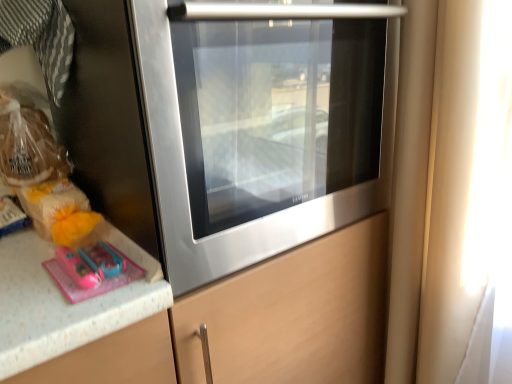
Where is `stainless steel oven at center`? The height and width of the screenshot is (384, 512). stainless steel oven at center is located at coordinates (259, 125).

Does translucent plastic bread at left, marked as the first food in a top-to-bottom arrangement, have a greater width compared to translucent plastic bag at left, which ranks as the 1th food in bottom-to-top order?

No.

From a real-world perspective, is translucent plastic bread at left, the second food in the bottom-to-top sequence, above or below translucent plastic bag at left, which ranks as the 2th food in top-to-bottom order?

From a real-world perspective, translucent plastic bread at left, the second food in the bottom-to-top sequence, is physically above translucent plastic bag at left, which ranks as the 2th food in top-to-bottom order.

The width and height of the screenshot is (512, 384). I want to click on food below the translucent plastic bread at left, the second food in the bottom-to-top sequence (from a real-world perspective), so click(x=60, y=212).

Is translucent plastic bread at left, marked as the first food in a top-to-bottom arrangement, next to translucent plastic bag at left, which ranks as the 1th food in bottom-to-top order, and touching it?

No.

From a real-world perspective, is stainless steel oven at center physically located above or below transparent glass window at right?

Clearly, from a real-world perspective, stainless steel oven at center is above transparent glass window at right.

Can you confirm if stainless steel oven at center is smaller than transparent glass window at right?

Incorrect, stainless steel oven at center is not smaller in size than transparent glass window at right.

Which object is closer to the camera, stainless steel oven at center or transparent glass window at right?

stainless steel oven at center is more forward.

In order to click on food that is above the translucent plastic bag at left, which ranks as the 2th food in top-to-bottom order (from the image's perspective) in this screenshot , I will do `click(28, 146)`.

Is translucent plastic bag at left, which ranks as the 2th food in top-to-bottom order, outside of translucent plastic bread at left, marked as the first food in a top-to-bottom arrangement?

translucent plastic bag at left, which ranks as the 2th food in top-to-bottom order, is positioned outside translucent plastic bread at left, marked as the first food in a top-to-bottom arrangement.

In the image, is translucent plastic bag at left, which ranks as the 2th food in top-to-bottom order, on the left side or the right side of translucent plastic bread at left, marked as the first food in a top-to-bottom arrangement?

translucent plastic bag at left, which ranks as the 2th food in top-to-bottom order, is positioned on translucent plastic bread at left, marked as the first food in a top-to-bottom arrangement,'s right side.

Does translucent plastic bag at left, which ranks as the 1th food in bottom-to-top order, have a lesser width compared to translucent plastic bread at left, the second food in the bottom-to-top sequence?

No.

Which object is further away from the camera taking this photo, transparent glass window at right or translucent plastic bag at left, which ranks as the 2th food in top-to-bottom order?

Positioned behind is translucent plastic bag at left, which ranks as the 2th food in top-to-bottom order.

What's the angular difference between transparent glass window at right and translucent plastic bag at left, which ranks as the 2th food in top-to-bottom order,'s facing directions?

transparent glass window at right and translucent plastic bag at left, which ranks as the 2th food in top-to-bottom order, are facing 90 degrees away from each other.

Considering the sizes of objects transparent glass window at right and translucent plastic bag at left, which ranks as the 1th food in bottom-to-top order, in the image provided, who is thinner, transparent glass window at right or translucent plastic bag at left, which ranks as the 1th food in bottom-to-top order,?

Thinner between the two is transparent glass window at right.

Is transparent glass window at right positioned with its back to translucent plastic bag at left, which ranks as the 1th food in bottom-to-top order?

No.

Is translucent plastic bread at left, marked as the first food in a top-to-bottom arrangement, aimed at transparent glass window at right?

No, translucent plastic bread at left, marked as the first food in a top-to-bottom arrangement, is not turned towards transparent glass window at right.

From the image's perspective, is translucent plastic bread at left, marked as the first food in a top-to-bottom arrangement, above or below transparent glass window at right?

translucent plastic bread at left, marked as the first food in a top-to-bottom arrangement, is situated higher than transparent glass window at right in the image.

Which object is wider, translucent plastic bread at left, marked as the first food in a top-to-bottom arrangement, or transparent glass window at right?

transparent glass window at right.

Can you confirm if translucent plastic bread at left, the second food in the bottom-to-top sequence, is bigger than transparent glass window at right?

No, translucent plastic bread at left, the second food in the bottom-to-top sequence, is not bigger than transparent glass window at right.

Is translucent plastic bag at left, which ranks as the 2th food in top-to-bottom order, taller than transparent glass window at right?

Incorrect, the height of translucent plastic bag at left, which ranks as the 2th food in top-to-bottom order, is not larger of that of transparent glass window at right.

From a real-world perspective, is translucent plastic bag at left, which ranks as the 1th food in bottom-to-top order, on top of transparent glass window at right?

Yes, from a real-world perspective, translucent plastic bag at left, which ranks as the 1th food in bottom-to-top order, is on top of transparent glass window at right.

Is translucent plastic bag at left, which ranks as the 1th food in bottom-to-top order, positioned far away from transparent glass window at right?

No, there isn't a large distance between translucent plastic bag at left, which ranks as the 1th food in bottom-to-top order, and transparent glass window at right.

Looking at their sizes, would you say translucent plastic bag at left, which ranks as the 1th food in bottom-to-top order, is wider or thinner than transparent glass window at right?

translucent plastic bag at left, which ranks as the 1th food in bottom-to-top order, is wider than transparent glass window at right.

Is stainless steel oven at center taller than translucent plastic bag at left, which ranks as the 1th food in bottom-to-top order?

Indeed, stainless steel oven at center has a greater height compared to translucent plastic bag at left, which ranks as the 1th food in bottom-to-top order.

Can you confirm if stainless steel oven at center is bigger than translucent plastic bag at left, which ranks as the 2th food in top-to-bottom order?

Yes, stainless steel oven at center is bigger than translucent plastic bag at left, which ranks as the 2th food in top-to-bottom order.

Considering the positions of objects stainless steel oven at center and translucent plastic bag at left, which ranks as the 1th food in bottom-to-top order, in the image provided, who is more to the right, stainless steel oven at center or translucent plastic bag at left, which ranks as the 1th food in bottom-to-top order,?

stainless steel oven at center is more to the right.

From the image's perspective, between stainless steel oven at center and translucent plastic bag at left, which ranks as the 2th food in top-to-bottom order, who is located below?

translucent plastic bag at left, which ranks as the 2th food in top-to-bottom order.

Locate an element on the screen. This screenshot has height=384, width=512. food that is behind the translucent plastic bag at left, which ranks as the 2th food in top-to-bottom order is located at coordinates (28, 146).

Image resolution: width=512 pixels, height=384 pixels. Identify the location of home appliance above the transparent glass window at right (from the image's perspective). (259, 125).

From the image, which object appears to be nearer to translucent plastic bag at left, which ranks as the 2th food in top-to-bottom order, translucent plastic bread at left, marked as the first food in a top-to-bottom arrangement, or transparent glass window at right?

translucent plastic bread at left, marked as the first food in a top-to-bottom arrangement, lies closer to translucent plastic bag at left, which ranks as the 2th food in top-to-bottom order, than the other object.

Estimate the real-world distances between objects in this image. Which object is further from translucent plastic bread at left, marked as the first food in a top-to-bottom arrangement, translucent plastic bag at left, which ranks as the 1th food in bottom-to-top order, or stainless steel oven at center?

stainless steel oven at center.

Looking at the image, which one is located closer to stainless steel oven at center, translucent plastic bread at left, marked as the first food in a top-to-bottom arrangement, or translucent plastic bag at left, which ranks as the 2th food in top-to-bottom order?

The object closer to stainless steel oven at center is translucent plastic bag at left, which ranks as the 2th food in top-to-bottom order.

Which object lies nearer to the anchor point translucent plastic bag at left, which ranks as the 1th food in bottom-to-top order, stainless steel oven at center or transparent glass window at right?

stainless steel oven at center.

Looking at the image, which one is located further to translucent plastic bread at left, marked as the first food in a top-to-bottom arrangement, transparent glass window at right or stainless steel oven at center?

transparent glass window at right is positioned further to the anchor translucent plastic bread at left, marked as the first food in a top-to-bottom arrangement.

Looking at this image, considering their positions, is stainless steel oven at center positioned further to translucent plastic bag at left, which ranks as the 1th food in bottom-to-top order, than translucent plastic bread at left, the second food in the bottom-to-top sequence?

Based on the image, stainless steel oven at center appears to be further to translucent plastic bag at left, which ranks as the 1th food in bottom-to-top order.

Based on their spatial positions, is transparent glass window at right or translucent plastic bag at left, which ranks as the 1th food in bottom-to-top order, closer to translucent plastic bread at left, the second food in the bottom-to-top sequence?

Based on the image, translucent plastic bag at left, which ranks as the 1th food in bottom-to-top order, appears to be nearer to translucent plastic bread at left, the second food in the bottom-to-top sequence.

Which object lies nearer to the anchor point transparent glass window at right, translucent plastic bread at left, marked as the first food in a top-to-bottom arrangement, or translucent plastic bag at left, which ranks as the 1th food in bottom-to-top order?

translucent plastic bag at left, which ranks as the 1th food in bottom-to-top order, is closer to transparent glass window at right.

Locate an element on the screen. This screenshot has height=384, width=512. food between translucent plastic bread at left, the second food in the bottom-to-top sequence, and stainless steel oven at center, in the horizontal direction is located at coordinates (60, 212).

Find the location of a particular element. This screenshot has width=512, height=384. home appliance between translucent plastic bread at left, the second food in the bottom-to-top sequence, and transparent glass window at right from left to right is located at coordinates (259, 125).

Find the location of `food between translucent plastic bread at left, the second food in the bottom-to-top sequence, and transparent glass window at right, in the horizontal direction`. food between translucent plastic bread at left, the second food in the bottom-to-top sequence, and transparent glass window at right, in the horizontal direction is located at coordinates (60, 212).

Locate an element on the screen. home appliance situated between translucent plastic bag at left, which ranks as the 1th food in bottom-to-top order, and transparent glass window at right from left to right is located at coordinates (259, 125).